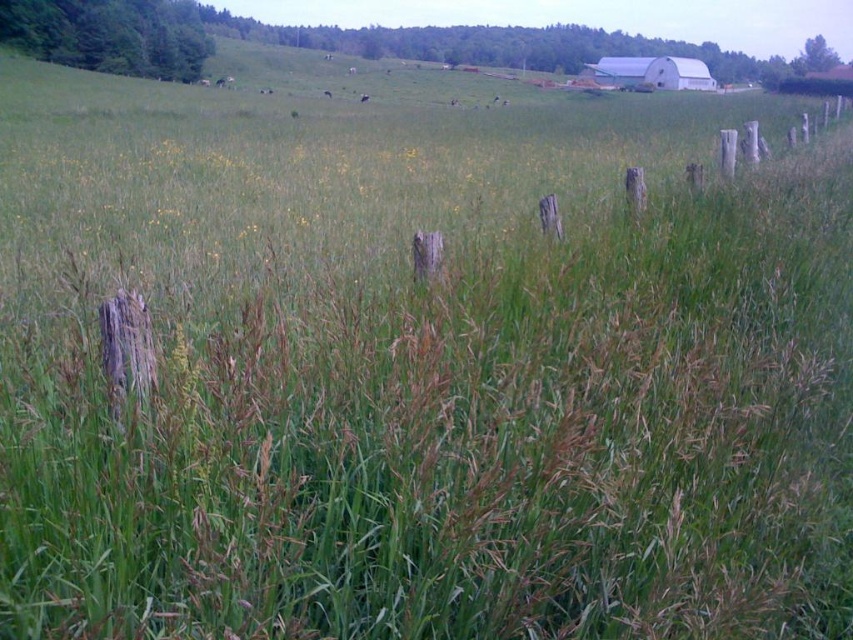
Question: Which object appears farthest from the camera in this image?

Choices:
 (A) weathered wood fence posts at center
 (B) white matte barn at upper right

Answer: (B)

Question: From the image, what is the correct spatial relationship of weathered wood fence posts at center in relation to white matte barn at upper right?

Choices:
 (A) below
 (B) above

Answer: (A)

Question: Among these points, which one is farthest from the camera?

Choices:
 (A) (674, 58)
 (B) (434, 147)

Answer: (A)

Question: Can you confirm if weathered wood fence posts at center is positioned to the left of white matte barn at upper right?

Choices:
 (A) yes
 (B) no

Answer: (A)

Question: Is weathered wood fence posts at center smaller than white matte barn at upper right?

Choices:
 (A) no
 (B) yes

Answer: (A)